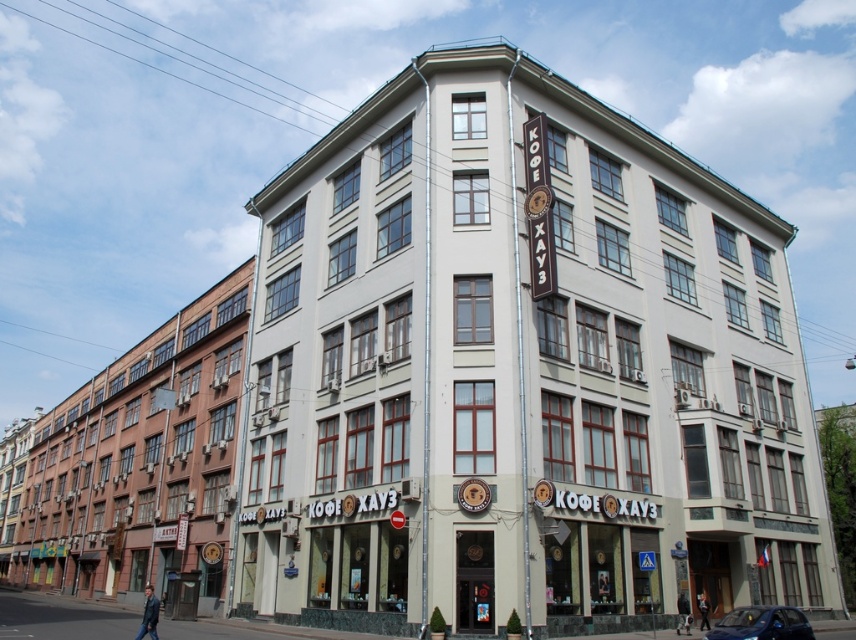
Between white smooth building at center and shiny blue car at lower right, which one is positioned higher?

Positioned higher is white smooth building at center.

Is white smooth building at center closer to camera compared to shiny blue car at lower right?

That is False.

Where is `white smooth building at center`? This screenshot has width=856, height=640. white smooth building at center is located at coordinates (520, 371).

Is point (355, 356) positioned before point (63, 468)?

Yes, point (355, 356) is in front of point (63, 468).

The height and width of the screenshot is (640, 856). What do you see at coordinates (520, 371) in the screenshot? I see `white smooth building at center` at bounding box center [520, 371].

You are a GUI agent. You are given a task and a screenshot of the screen. Output one action in this format:
    pyautogui.click(x=<x>, y=<y>)
    Task: Click on the white smooth building at center
    
    Given the screenshot: What is the action you would take?
    pyautogui.click(x=520, y=371)

Who is more forward, (131, 413) or (765, 637)?

Point (765, 637) is more forward.

Is point (230, 448) positioned before point (710, 637)?

No, (230, 448) is behind (710, 637).

I want to click on matte brown building at left, so click(x=140, y=460).